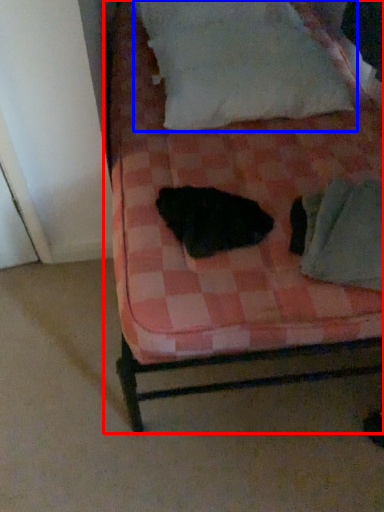
Question: Which object appears farthest to the camera in this image, bed (highlighted by a red box) or pillow (highlighted by a blue box)?

Choices:
 (A) bed
 (B) pillow

Answer: (B)